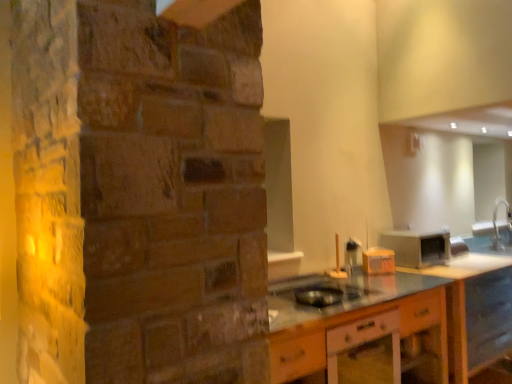
Question: Is wooden cabinet at lower center not inside silver metallic faucet at right?

Choices:
 (A) no
 (B) yes

Answer: (B)

Question: Is wooden cabinet at lower center surrounding silver metallic faucet at right?

Choices:
 (A) yes
 (B) no

Answer: (B)

Question: Considering the relative sizes of wooden cabinet at lower center and silver metallic faucet at right in the image provided, is wooden cabinet at lower center wider than silver metallic faucet at right?

Choices:
 (A) yes
 (B) no

Answer: (A)

Question: Is wooden cabinet at lower center far away from silver metallic faucet at right?

Choices:
 (A) yes
 (B) no

Answer: (A)

Question: Is wooden cabinet at lower center with silver metallic faucet at right?

Choices:
 (A) yes
 (B) no

Answer: (B)

Question: Is wooden cabinet at lower center taller than silver metallic faucet at right?

Choices:
 (A) yes
 (B) no

Answer: (A)

Question: Does orange plastic toaster at center, arranged as the second appliance when viewed from the left, turn towards black plastic bowl at center, which is counted as the third appliance, starting from the right?

Choices:
 (A) yes
 (B) no

Answer: (B)

Question: Is orange plastic toaster at center, arranged as the second appliance when viewed from the left, shorter than black plastic bowl at center, arranged as the first appliance when viewed from the front?

Choices:
 (A) yes
 (B) no

Answer: (B)

Question: From the image's perspective, is orange plastic toaster at center, which ranks as the 2th appliance in back-to-front order, below black plastic bowl at center, arranged as the first appliance when viewed from the front?

Choices:
 (A) no
 (B) yes

Answer: (A)

Question: Considering the relative sizes of orange plastic toaster at center, which ranks as the 2th appliance in back-to-front order, and black plastic bowl at center, arranged as the first appliance when viewed from the front, in the image provided, is orange plastic toaster at center, which ranks as the 2th appliance in back-to-front order, wider than black plastic bowl at center, arranged as the first appliance when viewed from the front,?

Choices:
 (A) no
 (B) yes

Answer: (A)

Question: Is the depth of orange plastic toaster at center, which ranks as the 2th appliance in back-to-front order, greater than that of black plastic bowl at center, which is counted as the third appliance, starting from the right?

Choices:
 (A) no
 (B) yes

Answer: (B)

Question: Considering the relative sizes of orange plastic toaster at center, arranged as the 2th appliance when viewed from the right, and black plastic bowl at center, which is counted as the third appliance, starting from the right, in the image provided, is orange plastic toaster at center, arranged as the 2th appliance when viewed from the right, thinner than black plastic bowl at center, which is counted as the third appliance, starting from the right,?

Choices:
 (A) no
 (B) yes

Answer: (B)

Question: Is metallic silver toaster at right, marked as the 3th appliance in a left-to-right arrangement, oriented towards wooden cabinet at lower center?

Choices:
 (A) no
 (B) yes

Answer: (A)